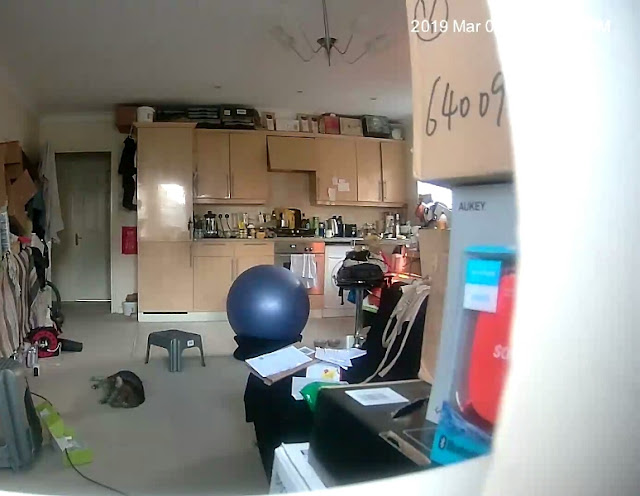
This screenshot has height=496, width=640. What are the coordinates of `clothing rack` in the screenshot? It's located at (13, 316), (24, 270), (47, 255).